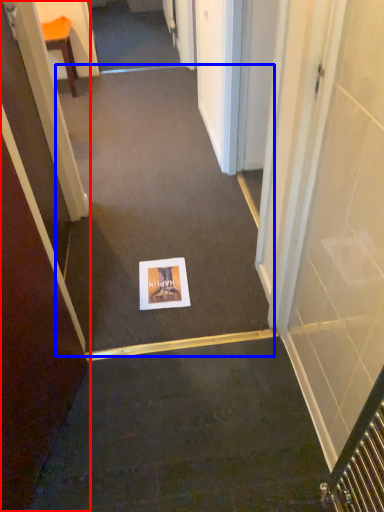
Question: Which point is further to the camera, door (highlighted by a red box) or path (highlighted by a blue box)?

Choices:
 (A) door
 (B) path

Answer: (B)